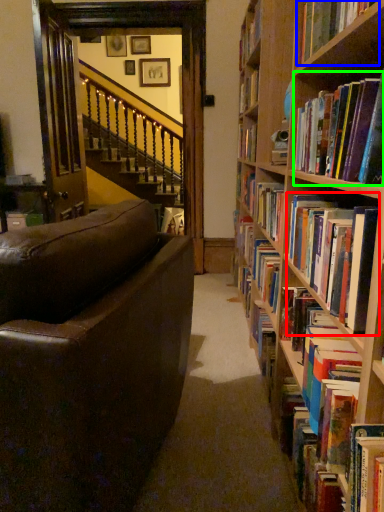
Question: Which object is the farthest from book (highlighted by a red box)? Choose among these: book (highlighted by a blue box) or book (highlighted by a green box).

Choices:
 (A) book
 (B) book

Answer: (A)